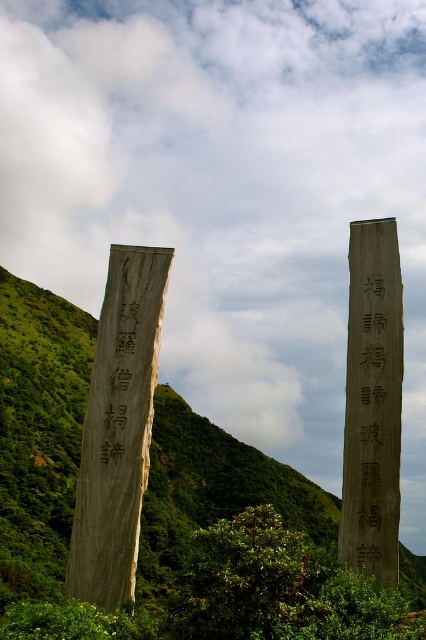
Does green wood hillside at center come in front of wooden signpost at center-right?

That is True.

Describe the element at coordinates (40, 435) in the screenshot. I see `green wood hillside at center` at that location.

You are a GUI agent. You are given a task and a screenshot of the screen. Output one action in this format:
    pyautogui.click(x=<x>, y=<y>)
    Task: Click on the green wood hillside at center
    This screenshot has height=640, width=426.
    Given the screenshot: What is the action you would take?
    pyautogui.click(x=40, y=435)

Which is below, green wood hillside at center or smooth gray stone monument at right?

green wood hillside at center

Is point (181, 448) less distant than point (374, 541)?

No, it is behind (374, 541).

Where is `green wood hillside at center`? green wood hillside at center is located at coordinates (40, 435).

How much distance is there between wooden signpost at left and black wood sign at left?

They are 12.35 inches apart.

Is point (124, 499) positioned behind point (115, 380)?

That is False.

Where is `wooden signpost at left`? This screenshot has width=426, height=640. wooden signpost at left is located at coordinates (118, 428).